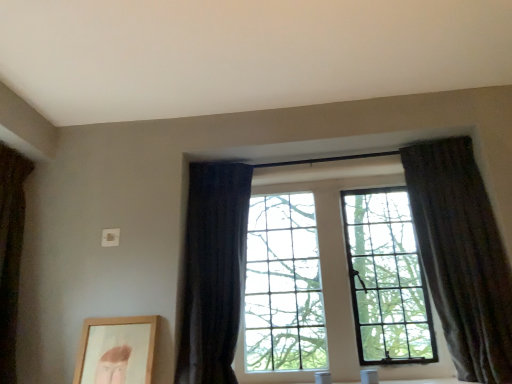
Question: From a real-world perspective, is dark fabric curtain at left, acting as the first curtain starting from the left, positioned above or below wooden picture frame at lower left?

Choices:
 (A) above
 (B) below

Answer: (A)

Question: Considering the relative positions of dark fabric curtain at left, acting as the first curtain starting from the left, and wooden picture frame at lower left in the image provided, is dark fabric curtain at left, acting as the first curtain starting from the left, to the left or to the right of wooden picture frame at lower left?

Choices:
 (A) right
 (B) left

Answer: (B)

Question: Estimate the real-world distances between objects in this image. Which object is closer to the dark fabric curtain at left, which is the third curtain from right to left?

Choices:
 (A) dark textured curtain at right, which ranks as the first curtain in right-to-left order
 (B) dark fabric curtain at center, placed as the second curtain when sorted from right to left
 (C) wooden picture frame at lower left

Answer: (C)

Question: Estimate the real-world distances between objects in this image. Which object is closer to the dark fabric curtain at center, the 2th curtain viewed from the left?

Choices:
 (A) wooden picture frame at lower left
 (B) dark textured curtain at right, which ranks as the first curtain in right-to-left order
 (C) dark fabric curtain at left, which is the third curtain from right to left

Answer: (A)